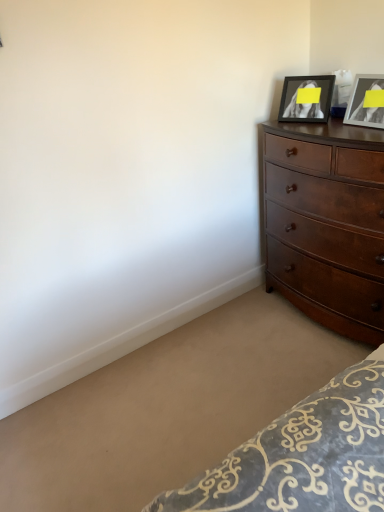
Question: Is dark brown wood dresser at right outside of matte black picture frame at upper right, the second picture frame positioned from the left?

Choices:
 (A) yes
 (B) no

Answer: (A)

Question: Is dark brown wood dresser at right looking in the opposite direction of matte black picture frame at upper right, the second picture frame positioned from the left?

Choices:
 (A) yes
 (B) no

Answer: (B)

Question: Can you confirm if dark brown wood dresser at right is bigger than matte black picture frame at upper right, the second picture frame positioned from the left?

Choices:
 (A) yes
 (B) no

Answer: (A)

Question: From a real-world perspective, is dark brown wood dresser at right below matte black picture frame at upper right, marked as the first picture frame in a right-to-left arrangement?

Choices:
 (A) no
 (B) yes

Answer: (B)

Question: Is dark brown wood dresser at right positioned behind matte black picture frame at upper right, marked as the first picture frame in a right-to-left arrangement?

Choices:
 (A) no
 (B) yes

Answer: (A)

Question: Looking at their shapes, would you say dark brown wood dresser at right is wider or thinner than matte black picture frame at upper right, which is the 2th picture frame in right-to-left order?

Choices:
 (A) thin
 (B) wide

Answer: (B)

Question: Is point (316, 258) closer or farther from the camera than point (312, 81)?

Choices:
 (A) closer
 (B) farther

Answer: (B)

Question: From a real-world perspective, is dark brown wood dresser at right positioned above or below matte black picture frame at upper right, marked as the 1th picture frame in a left-to-right arrangement?

Choices:
 (A) above
 (B) below

Answer: (B)

Question: In the image, is dark brown wood dresser at right positioned in front of or behind matte black picture frame at upper right, which is the 2th picture frame in right-to-left order?

Choices:
 (A) front
 (B) behind

Answer: (A)

Question: Is point (354, 250) positioned closer to the camera than point (349, 104)?

Choices:
 (A) farther
 (B) closer

Answer: (B)

Question: Is dark brown wood dresser at right situated inside matte black picture frame at upper right, marked as the first picture frame in a right-to-left arrangement, or outside?

Choices:
 (A) outside
 (B) inside

Answer: (A)

Question: Is dark brown wood dresser at right in front of or behind matte black picture frame at upper right, the second picture frame positioned from the left, in the image?

Choices:
 (A) front
 (B) behind

Answer: (A)

Question: From the image's perspective, is dark brown wood dresser at right positioned above or below matte black picture frame at upper right, the second picture frame positioned from the left?

Choices:
 (A) below
 (B) above

Answer: (A)

Question: Considering the positions of matte black picture frame at upper right, marked as the 1th picture frame in a left-to-right arrangement, and matte black picture frame at upper right, marked as the first picture frame in a right-to-left arrangement, in the image, is matte black picture frame at upper right, marked as the 1th picture frame in a left-to-right arrangement, wider or thinner than matte black picture frame at upper right, marked as the first picture frame in a right-to-left arrangement,?

Choices:
 (A) thin
 (B) wide

Answer: (B)

Question: Is matte black picture frame at upper right, which is the 2th picture frame in right-to-left order, bigger or smaller than matte black picture frame at upper right, marked as the first picture frame in a right-to-left arrangement?

Choices:
 (A) small
 (B) big

Answer: (B)